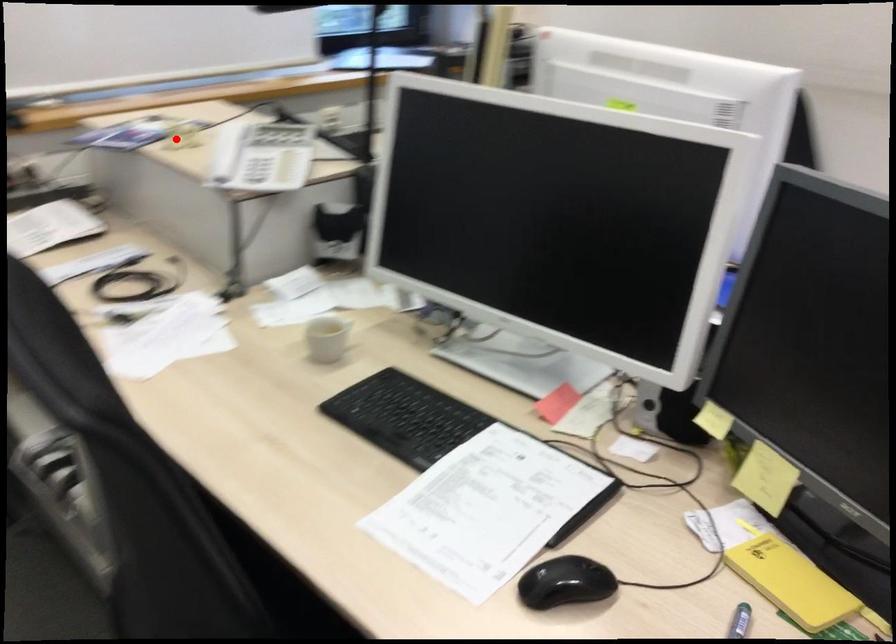
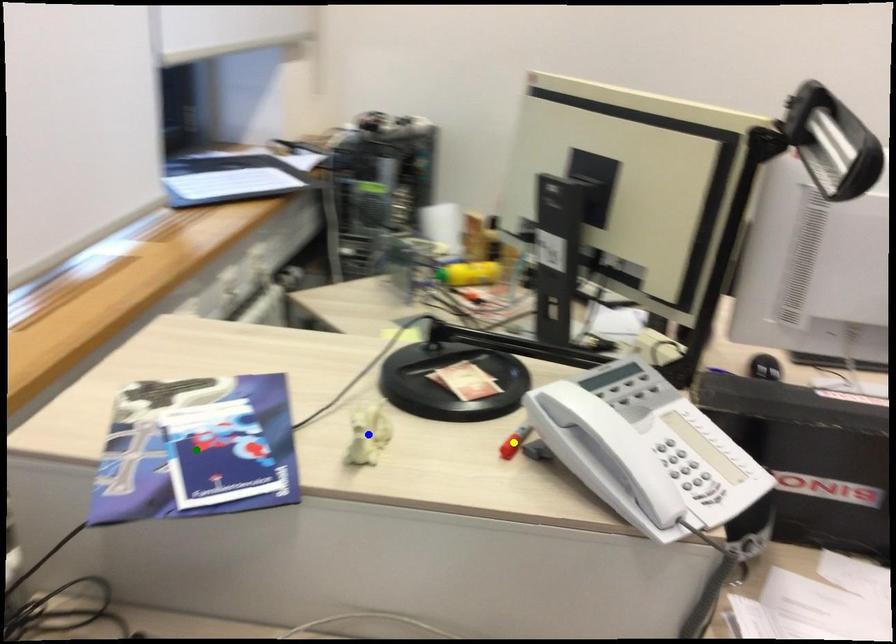
Question: I am providing you with two images of the same scene from different viewpoints. A red point is marked on the first image. You are given multiple points on the second image. Which mark in image 2 goes with the point in image 1?

Choices:
 (A) yellow point
 (B) green point
 (C) blue point

Answer: (C)